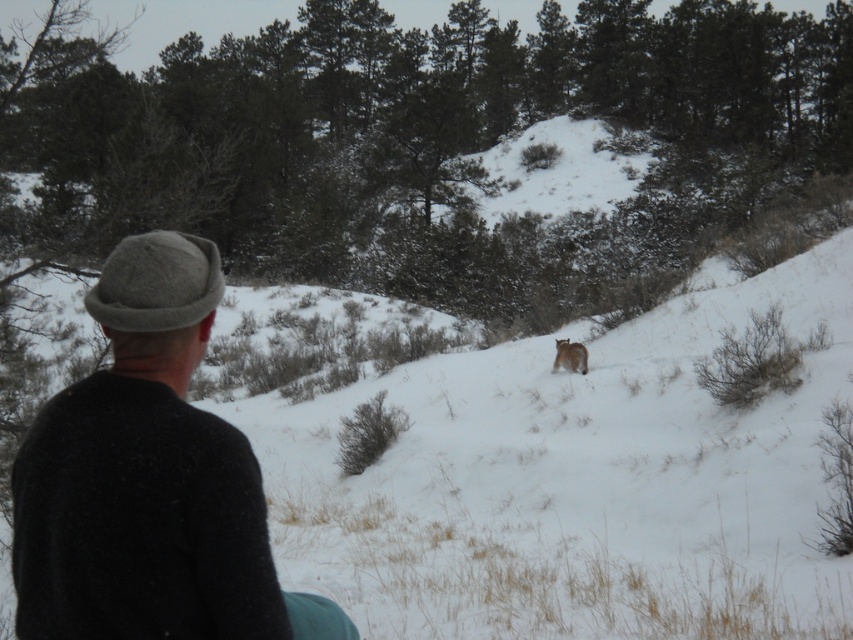
Question: Can you confirm if gray woolen hat at left is positioned below furry brown cat at center?

Choices:
 (A) no
 (B) yes

Answer: (B)

Question: Among these objects, which one is nearest to the camera?

Choices:
 (A) furry brown cat at center
 (B) gray woolen hat at left

Answer: (B)

Question: Where is gray woolen hat at left located in relation to furry brown cat at center in the image?

Choices:
 (A) left
 (B) right

Answer: (A)

Question: Which point appears farthest from the camera in this image?

Choices:
 (A) (578, 356)
 (B) (131, 467)

Answer: (A)

Question: Does gray woolen hat at left have a larger size compared to furry brown cat at center?

Choices:
 (A) yes
 (B) no

Answer: (A)